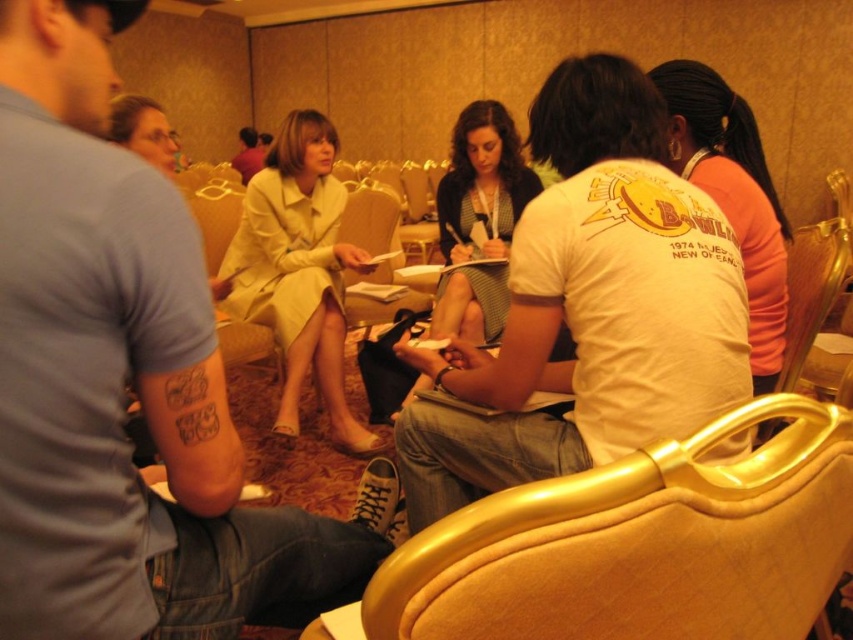
You are a photographer setting up for a group photo in the conference room. You notice the denim jeans at center and the light beige suit at center. Which clothing item is closer to the camera?

The denim jeans at center is positioned under the light beige suit at center, so the light beige suit at center is closer to the camera.

You are organizing a photoshoot and need to place a small prop between the white matte shirt at upper right and the light beige suit at center. Based on their sizes, which object should the prop be closer to?

The prop should be closer to the light beige suit at center because the white matte shirt at upper right occupies less space than the light beige suit at center, meaning the light beige suit at center is larger and thus the prop should be placed nearer to it.

You are a photographer setting up for a photoshoot in this conference room. You need to ensure that the denim jeans at center and the matte black dress at center are both visible in the frame. Based on their positions, which clothing item is closer to the camera?

The denim jeans at center is positioned under the matte black dress at center, so the denim jeans at center is closer to the camera because it is below the dress in the frame.